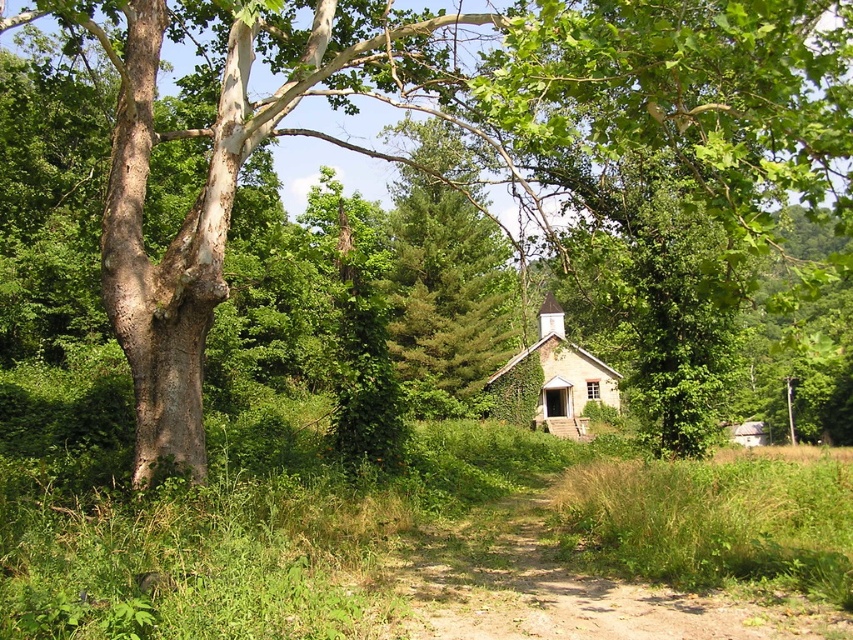
Can you confirm if smooth bark tree at left is thinner than green needle-like at center?

In fact, smooth bark tree at left might be wider than green needle-like at center.

Identify the location of smooth bark tree at left. (223, 164).

Is point (231, 60) positioned after point (399, 259)?

No.

At what (x,y) coordinates should I click in order to perform the action: click on smooth bark tree at left. Please return your answer as a coordinate pair (x, y). The width and height of the screenshot is (853, 640). Looking at the image, I should click on (223, 164).

What do you see at coordinates (561, 588) in the screenshot? I see `brown dirt track at center` at bounding box center [561, 588].

Is brown dirt track at center taller than light brown wooden hut at center?

Incorrect, brown dirt track at center's height is not larger of light brown wooden hut at center's.

Does point (641, 627) come closer to viewer compared to point (561, 378)?

Yes, point (641, 627) is closer to viewer.

At what (x,y) coordinates should I click in order to perform the action: click on brown dirt track at center. Please return your answer as a coordinate pair (x, y). Looking at the image, I should click on (561, 588).

Is point (729, 620) more distant than point (421, 333)?

No, (729, 620) is in front of (421, 333).

Can you confirm if brown dirt track at center is positioned to the right of green needle-like at center?

Yes, brown dirt track at center is to the right of green needle-like at center.

Is point (508, 529) closer to camera compared to point (432, 332)?

Yes, it is in front of point (432, 332).

At what (x,y) coordinates should I click in order to perform the action: click on brown dirt track at center. Please return your answer as a coordinate pair (x, y). This screenshot has height=640, width=853. Looking at the image, I should click on (561, 588).